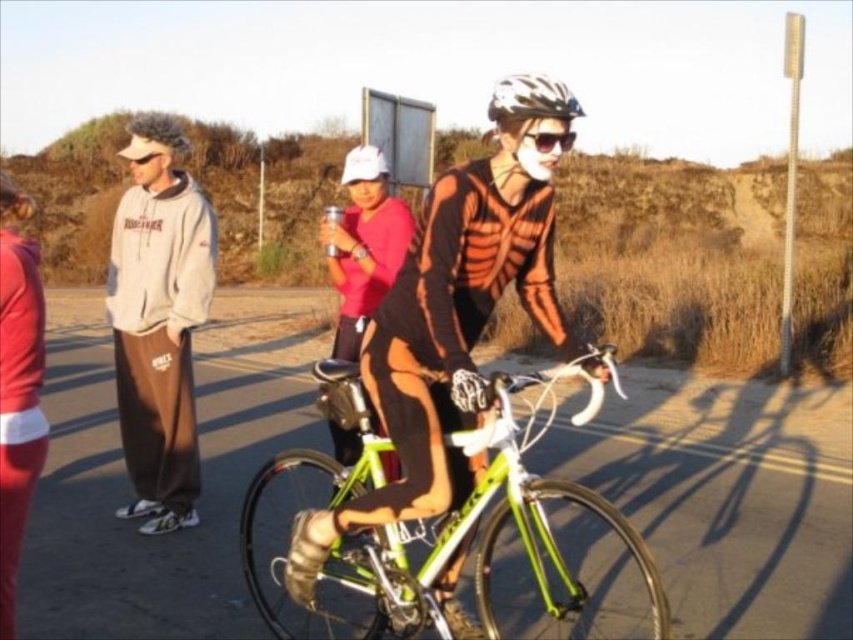
Between green metallic bicycle at center and matte red shirt at center, which one is positioned lower?

green metallic bicycle at center

At what (x,y) coordinates should I click in order to perform the action: click on green metallic bicycle at center. Please return your answer as a coordinate pair (x, y). The height and width of the screenshot is (640, 853). Looking at the image, I should click on (491, 525).

Between matte pink hoodie at lower left and white matte bicycle helmet at upper center, which one appears on the left side from the viewer's perspective?

Positioned to the left is matte pink hoodie at lower left.

Between matte pink hoodie at lower left and white matte bicycle helmet at upper center, which one has less height?

With less height is white matte bicycle helmet at upper center.

Image resolution: width=853 pixels, height=640 pixels. Identify the location of matte pink hoodie at lower left. (16, 388).

In order to click on matte pink hoodie at lower left in this screenshot , I will do `click(16, 388)`.

Does green metallic bicycle at center appear on the left side of matte pink hoodie at lower left?

No, green metallic bicycle at center is not to the left of matte pink hoodie at lower left.

Where is `green metallic bicycle at center`? This screenshot has width=853, height=640. green metallic bicycle at center is located at coordinates (491, 525).

Identify the location of green metallic bicycle at center. The width and height of the screenshot is (853, 640). (491, 525).